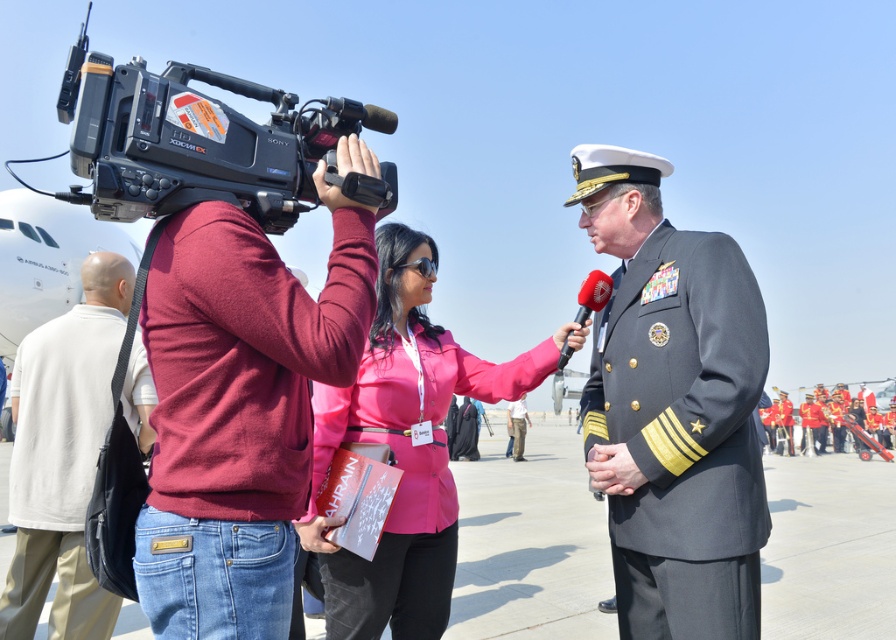
You are a fashion designer observing the scene at the airfield. You notice the maroon sweater at center and the dark blue fabric uniform at center. Which of these two items of clothing has a smaller size?

The maroon sweater at center has a smaller size compared to the dark blue fabric uniform at center.

You are a photographer at the airfield. You need to capture a photo of both the pink fabric shirt at center and the black plastic video camera at upper left. Which object should you focus on first to ensure it appears larger in your photo?

The pink fabric shirt at center is bigger than the black plastic video camera at upper left, so you should focus on the pink fabric shirt at center first to ensure it appears larger in your photo.

You are a costume designer preparing for a historical drama. You need to place two uniforms, the dark gray wool military uniform at center and the dark blue fabric uniform at center, on a rack for a scene. The rack has a width of 1.5 meters. Can both uniforms fit side by side on the rack without overlapping?

The dark gray wool military uniform at center and dark blue fabric uniform at center are 1.49 meters apart from each other. Since the rack is 1.5 meters wide, there is enough space to place both uniforms side by side without overlapping.